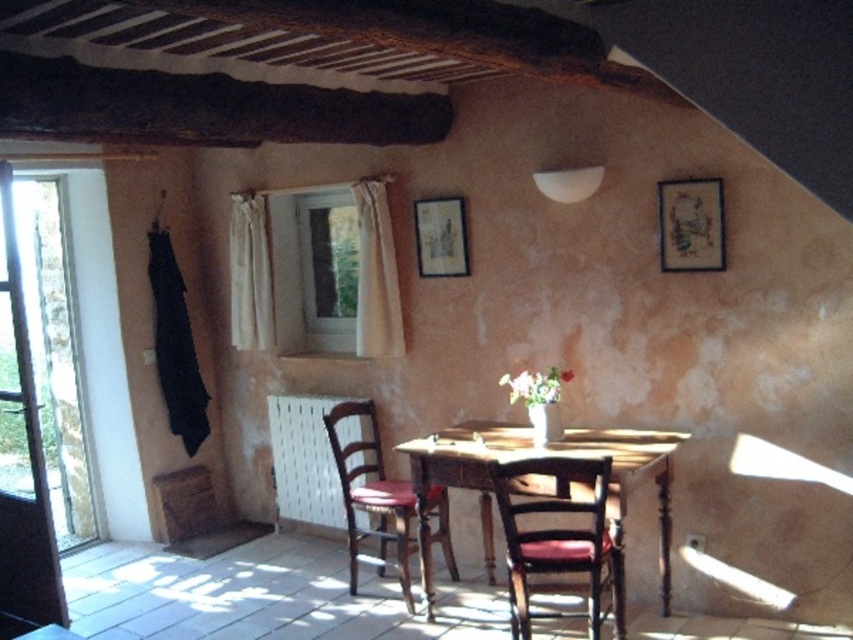
Question: Which object appears farthest from the camera in this image?

Choices:
 (A) wooden chair with cushion at center
 (B) matte wooden picture frame at upper right
 (C) wooden picture frame at upper center

Answer: (C)

Question: Where is wooden chair with red cushion at center located in relation to matte wooden picture frame at upper right in the image?

Choices:
 (A) left
 (B) right

Answer: (A)

Question: Is wooden chair with cushion at center thinner than matte wooden picture frame at upper right?

Choices:
 (A) no
 (B) yes

Answer: (A)

Question: Can you confirm if wooden chair with cushion at center is wider than wooden chair with red cushion at center?

Choices:
 (A) no
 (B) yes

Answer: (A)

Question: Which object appears farthest from the camera in this image?

Choices:
 (A) clear glass window at upper center
 (B) wooden table at center
 (C) wooden picture frame at upper center

Answer: (A)

Question: Which point appears farthest from the camera in this image?

Choices:
 (A) (395, 518)
 (B) (440, 244)
 (C) (341, 340)
 (D) (544, 532)

Answer: (C)